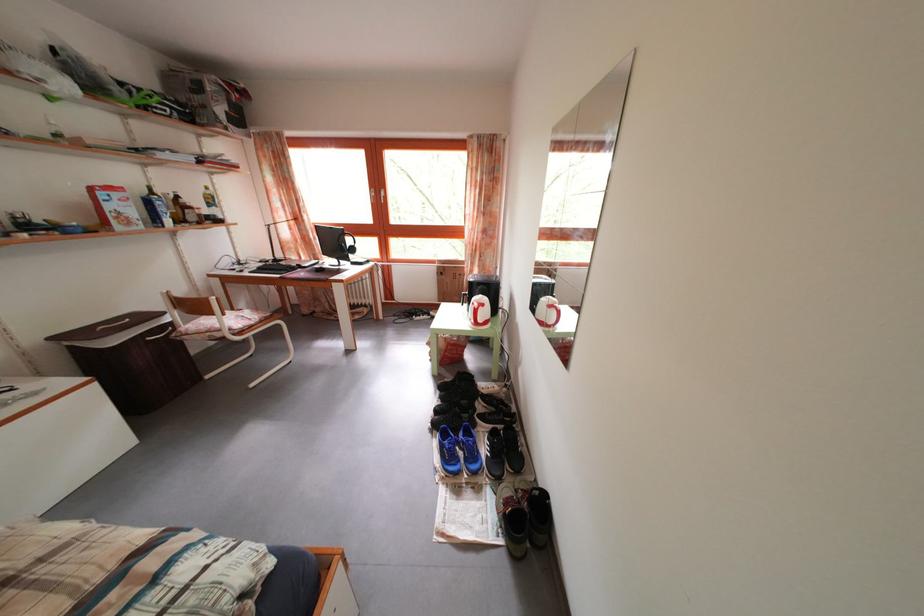
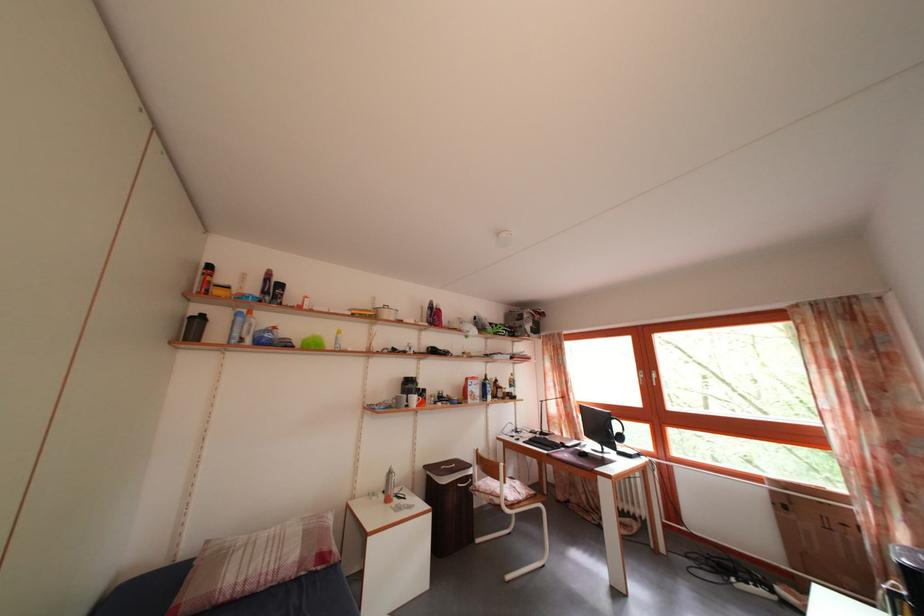
Where in the second image is the point corresponding to [284,268] from the first image?

(550, 440)